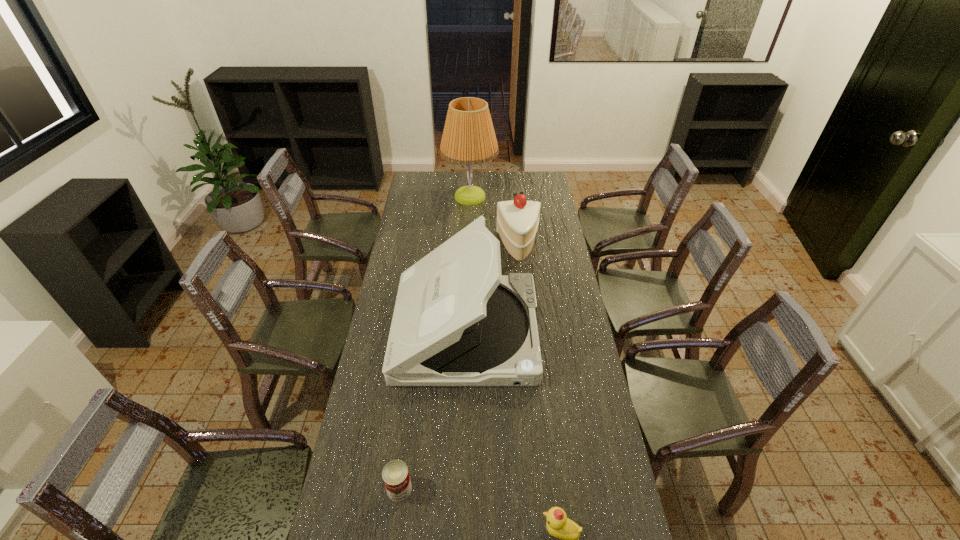
The image size is (960, 540). Identify the location of the tallest object. (468, 138).

You are a GUI agent. You are given a task and a screenshot of the screen. Output one action in this format:
    pyautogui.click(x=<x>, y=<y>)
    Task: Click on the lamp
    
    Given the screenshot: What is the action you would take?
    pyautogui.click(x=468, y=138)

The image size is (960, 540). What are the coordinates of `the fourth shortest object` in the screenshot? It's located at (457, 321).

Image resolution: width=960 pixels, height=540 pixels. I want to click on CD player, so click(x=457, y=321).

This screenshot has height=540, width=960. I want to click on the third tallest object, so click(x=517, y=221).

Identify the location of cake. (517, 221).

Locate an element on the screen. The image size is (960, 540). the second nearest object is located at coordinates (395, 474).

Where is `vacant area situated 0.150m on the side of the lamp near the pull switch`? The image size is (960, 540). vacant area situated 0.150m on the side of the lamp near the pull switch is located at coordinates (524, 197).

Find the location of `free location located on the control panel of the CD player`. free location located on the control panel of the CD player is located at coordinates (581, 332).

Locate an element on the screen. Image resolution: width=960 pixels, height=540 pixels. blank space located on the left of the third tallest object is located at coordinates (427, 246).